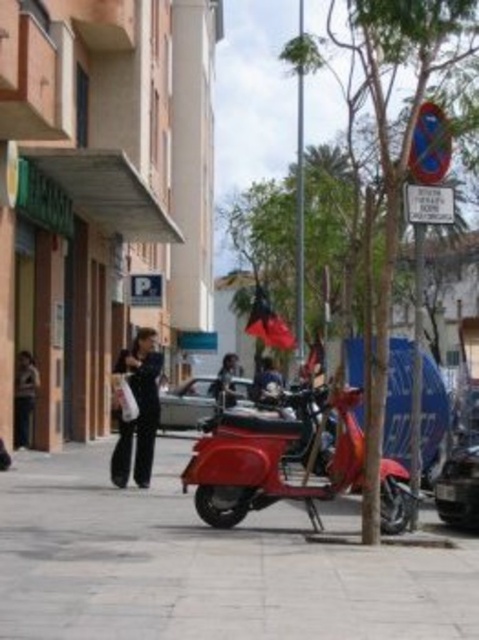
Can you confirm if black pants at center is shorter than dark blue fabric jacket at center?

In fact, black pants at center may be taller than dark blue fabric jacket at center.

Is black pants at center to the right of dark blue fabric jacket at center from the viewer's perspective?

In fact, black pants at center is to the left of dark blue fabric jacket at center.

Locate an element on the screen. Image resolution: width=479 pixels, height=640 pixels. black pants at center is located at coordinates (23, 397).

Does metallic silver car at lower right have a smaller size compared to silver metallic car at center?

Yes, metallic silver car at lower right is smaller than silver metallic car at center.

Does metallic silver car at lower right have a greater width compared to silver metallic car at center?

Incorrect, metallic silver car at lower right's width does not surpass silver metallic car at center's.

Does point (452, 476) come farther from viewer compared to point (174, 426)?

No, (452, 476) is closer to viewer.

I want to click on metallic silver car at lower right, so click(459, 483).

Is point (351, 464) behind point (264, 378)?

No, it is not.

Is shiny red scooter at center to the right of dark blue fabric jacket at center from the viewer's perspective?

Correct, you'll find shiny red scooter at center to the right of dark blue fabric jacket at center.

Between point (218, 451) and point (262, 397), which one is positioned in front?

Point (218, 451) is in front.

Locate an element on the screen. shiny red scooter at center is located at coordinates (267, 461).